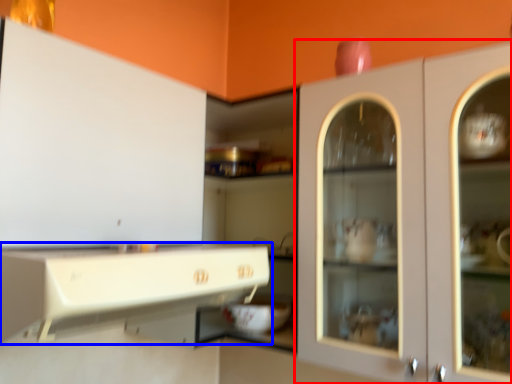
Question: Which of the following is the farthest to the observer, cabinetry (highlighted by a red box) or cabinetry (highlighted by a blue box)?

Choices:
 (A) cabinetry
 (B) cabinetry

Answer: (A)